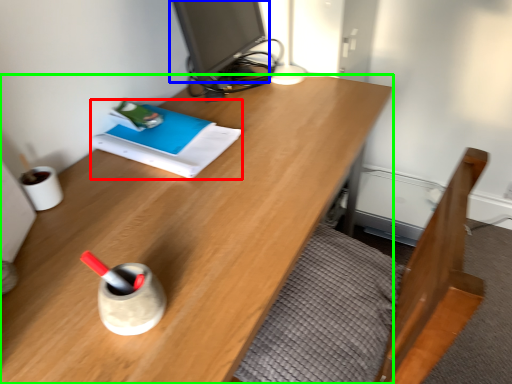
Question: Considering the real-world distances, which object is farthest from book (highlighted by a red box)? computer monitor (highlighted by a blue box) or desk (highlighted by a green box)?

Choices:
 (A) computer monitor
 (B) desk

Answer: (A)